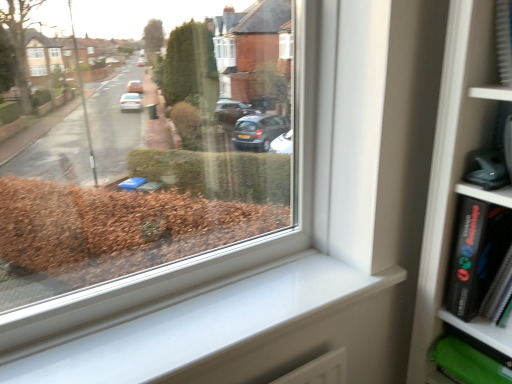
Question: Is black matte book at right bigger or smaller than white smooth window sill at lower right?

Choices:
 (A) big
 (B) small

Answer: (B)

Question: In terms of height, does black matte book at right look taller or shorter compared to white smooth window sill at lower right?

Choices:
 (A) tall
 (B) short

Answer: (A)

Question: From a real-world perspective, is black matte book at right positioned above or below white smooth window sill at lower right?

Choices:
 (A) below
 (B) above

Answer: (B)

Question: Looking at their shapes, would you say white smooth window sill at lower right is wider or thinner than black matte book at right?

Choices:
 (A) thin
 (B) wide

Answer: (B)

Question: Considering the positions of white smooth window sill at lower right and black matte book at right in the image, is white smooth window sill at lower right taller or shorter than black matte book at right?

Choices:
 (A) short
 (B) tall

Answer: (A)

Question: Relative to black matte book at right, is white smooth window sill at lower right in front or behind?

Choices:
 (A) behind
 (B) front

Answer: (B)

Question: Visually, is white smooth window sill at lower right positioned to the left or to the right of black matte book at right?

Choices:
 (A) left
 (B) right

Answer: (A)